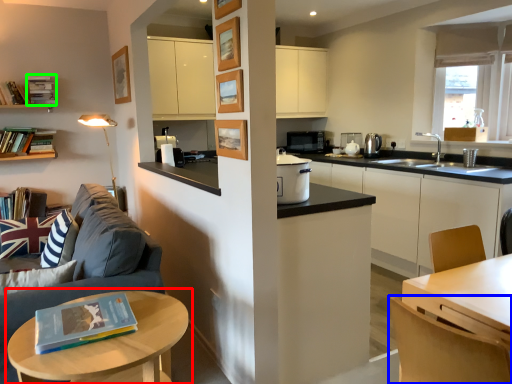
Question: Estimate the real-world distances between objects in this image. Which object is closer to table (highlighted by a red box), chair (highlighted by a blue box) or book (highlighted by a green box)?

Choices:
 (A) chair
 (B) book

Answer: (A)